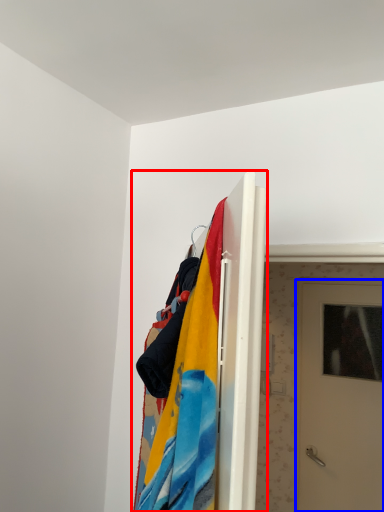
Question: Which object is further to the camera taking this photo, closet (highlighted by a red box) or door (highlighted by a blue box)?

Choices:
 (A) closet
 (B) door

Answer: (B)